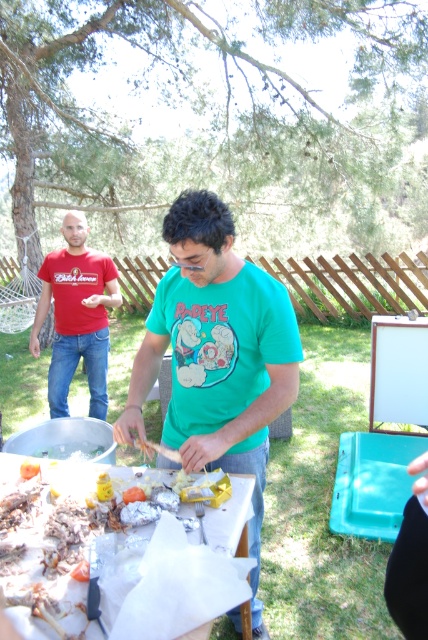
The height and width of the screenshot is (640, 428). Describe the element at coordinates (216, 356) in the screenshot. I see `green matte shirt at center` at that location.

Does green matte shirt at center appear on the right side of matte red t-shirt at left?

Correct, you'll find green matte shirt at center to the right of matte red t-shirt at left.

Between point (240, 294) and point (92, 308), which one is positioned behind?

Positioned behind is point (92, 308).

You are a GUI agent. You are given a task and a screenshot of the screen. Output one action in this format:
    pyautogui.click(x=<x>, y=<y>)
    Task: Click on the green matte shirt at center
    The image size is (428, 640).
    Given the screenshot: What is the action you would take?
    pyautogui.click(x=216, y=356)

Is point (58, 381) positioned after point (241, 604)?

Yes, point (58, 381) is farther from viewer.

Can you confirm if matte red t-shirt at left is taller than white paper at center?

Yes.

The height and width of the screenshot is (640, 428). What do you see at coordinates (77, 316) in the screenshot? I see `matte red t-shirt at left` at bounding box center [77, 316].

This screenshot has height=640, width=428. Identify the location of matte red t-shirt at left. (77, 316).

Measure the distance between green matte shirt at center and camera.

A distance of 1.55 meters exists between green matte shirt at center and camera.

Can you confirm if green matte shirt at center is wider than white paper at center?

Correct, the width of green matte shirt at center exceeds that of white paper at center.

Is point (187, 269) farther from camera compared to point (240, 556)?

No.

You are a GUI agent. You are given a task and a screenshot of the screen. Output one action in this format:
    pyautogui.click(x=<x>, y=<y>)
    Task: Click on the green matte shirt at center
    
    Given the screenshot: What is the action you would take?
    pyautogui.click(x=216, y=356)